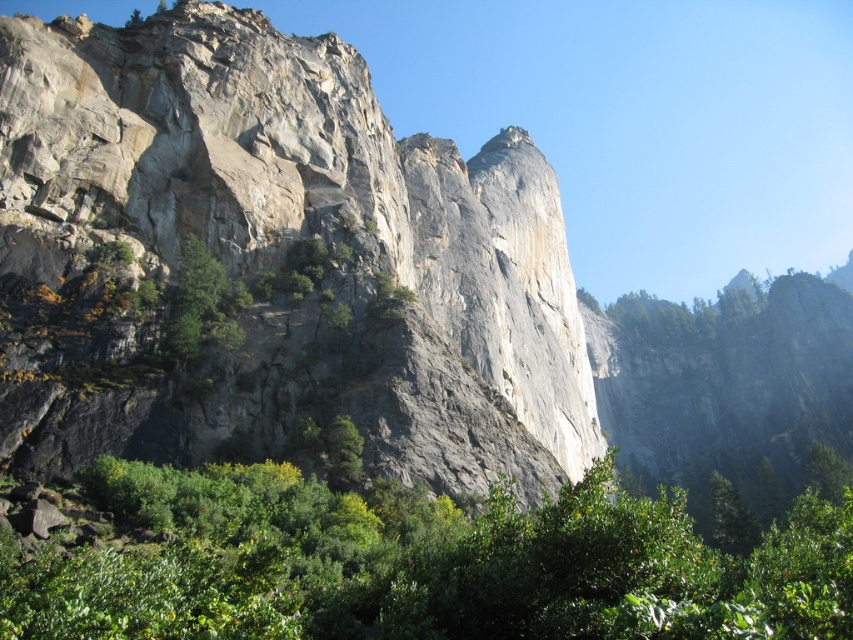
You are standing at the origin point of the image coordinate system. Where is the green leafy shrubs at lower center located in terms of coordinates?

The green leafy shrubs at lower center are located at coordinates approximately 0.883 in the x direction and 0.497 in the y direction.

You are standing in the middle of the natural landscape described. You notice a point marked at coordinates [422,564]. Based on the scene, what does this point most likely represent?

The point at [422,564] most likely represents the green leafy shrubs at lower center, as the description indicates this location corresponds to their position in the scene.

You are a hiker standing at the base of the cliffs and want to reach the green leafy shrubs at lower center and the green matte tree at left. Which one is closer to you?

The green leafy shrubs at lower center are closer to you than the green matte tree at left.